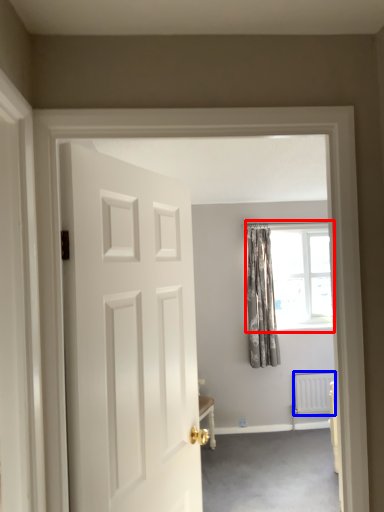
Question: Which point is further to the camera, window (highlighted by a red box) or radiator (highlighted by a blue box)?

Choices:
 (A) window
 (B) radiator

Answer: (A)